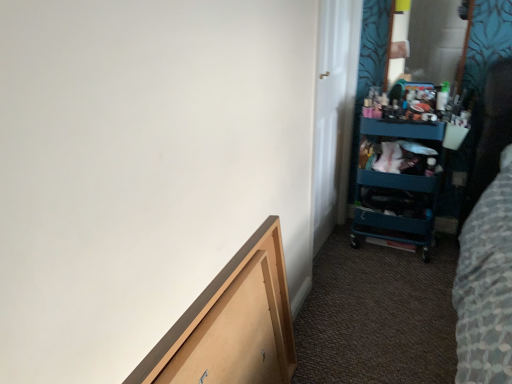
Question: Does teal plastic cart at right turn towards white glossy door at upper right?

Choices:
 (A) yes
 (B) no

Answer: (B)

Question: Would you say teal plastic cart at right is outside white glossy door at upper right?

Choices:
 (A) yes
 (B) no

Answer: (A)

Question: Considering the relative sizes of teal plastic cart at right and white glossy door at upper right in the image provided, is teal plastic cart at right shorter than white glossy door at upper right?

Choices:
 (A) yes
 (B) no

Answer: (A)

Question: Would you say teal plastic cart at right contains white glossy door at upper right?

Choices:
 (A) no
 (B) yes

Answer: (A)

Question: Can you confirm if teal plastic cart at right is positioned to the left of white glossy door at upper right?

Choices:
 (A) no
 (B) yes

Answer: (A)

Question: Is teal plastic cart at right wider than white glossy door at upper right?

Choices:
 (A) no
 (B) yes

Answer: (B)

Question: Does white glossy door at upper right have a smaller size compared to wooden drawer at lower left?

Choices:
 (A) yes
 (B) no

Answer: (B)

Question: Considering the relative sizes of white glossy door at upper right and wooden drawer at lower left in the image provided, is white glossy door at upper right bigger than wooden drawer at lower left?

Choices:
 (A) no
 (B) yes

Answer: (B)

Question: Is white glossy door at upper right to the left of wooden drawer at lower left from the viewer's perspective?

Choices:
 (A) yes
 (B) no

Answer: (B)

Question: Can you confirm if white glossy door at upper right is wider than wooden drawer at lower left?

Choices:
 (A) yes
 (B) no

Answer: (A)

Question: Is wooden drawer at lower left located within white glossy door at upper right?

Choices:
 (A) yes
 (B) no

Answer: (B)

Question: From a real-world perspective, is white glossy door at upper right beneath wooden drawer at lower left?

Choices:
 (A) no
 (B) yes

Answer: (A)

Question: Is white glossy door at upper right not inside teal plastic cart at right?

Choices:
 (A) yes
 (B) no

Answer: (A)